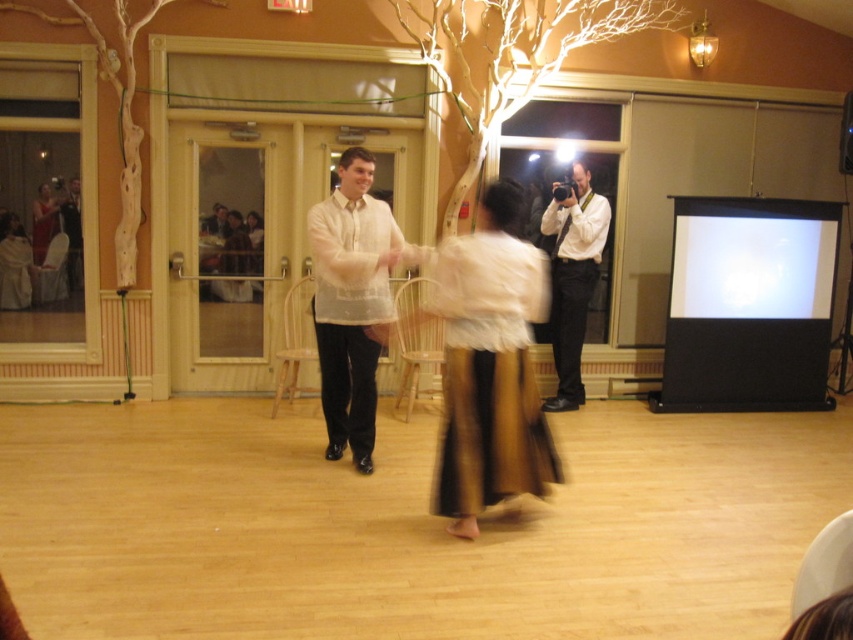
Does gold shimmering skirt at center appear on the left side of white sheer shirt at center?

Incorrect, gold shimmering skirt at center is not on the left side of white sheer shirt at center.

Can you confirm if gold shimmering skirt at center is smaller than white sheer shirt at center?

Yes.

The width and height of the screenshot is (853, 640). I want to click on gold shimmering skirt at center, so pos(490,365).

Locate an element on the screen. This screenshot has width=853, height=640. gold shimmering skirt at center is located at coordinates (490, 365).

Consider the image. Is white sheer shirt at center positioned at the back of white glossy projection screen at upper right?

No, white sheer shirt at center is in front of white glossy projection screen at upper right.

Which is behind, point (335, 428) or point (773, 257)?

The point (773, 257) is behind.

The height and width of the screenshot is (640, 853). In order to click on white sheer shirt at center in this screenshot , I will do `click(351, 301)`.

Who is shorter, gold shimmering skirt at center or white glossy shirt at upper right?

Standing shorter between the two is gold shimmering skirt at center.

Is gold shimmering skirt at center further to camera compared to white glossy shirt at upper right?

No, gold shimmering skirt at center is closer to the viewer.

At what (x,y) coordinates should I click in order to perform the action: click on gold shimmering skirt at center. Please return your answer as a coordinate pair (x, y). Looking at the image, I should click on (490, 365).

Identify the location of gold shimmering skirt at center. This screenshot has height=640, width=853. (490, 365).